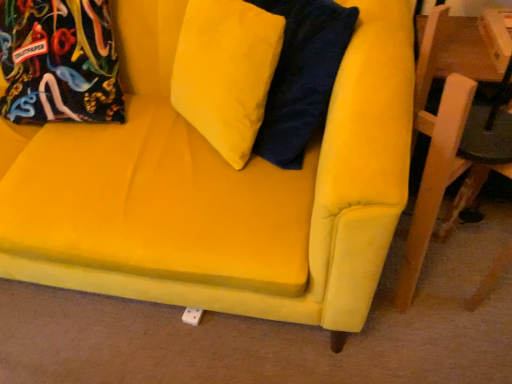
Question: Should I look upward or downward to see wooden chair at right?

Choices:
 (A) up
 (B) down

Answer: (A)